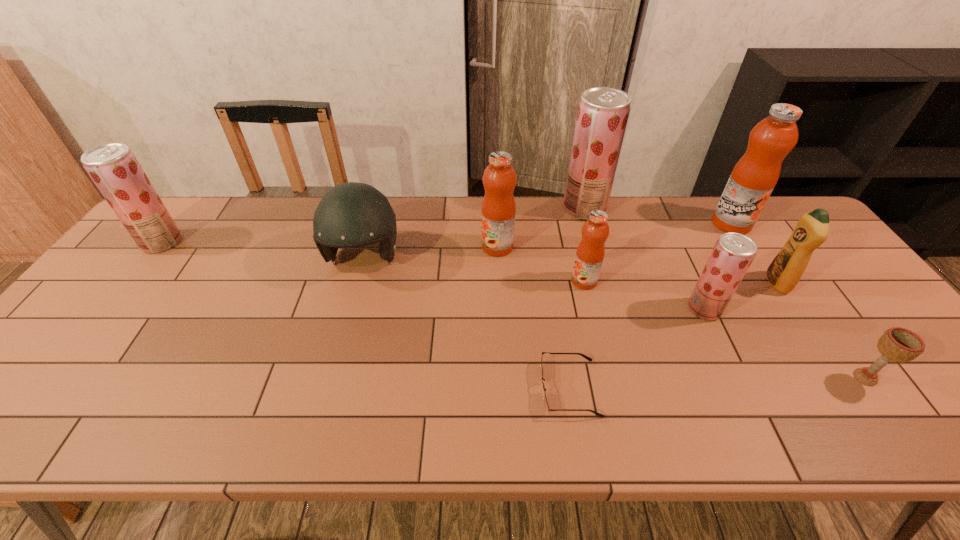
I want to click on free space that is in between the second object from left to right and the spectacles, so click(467, 323).

The image size is (960, 540). What are the coordinates of `vacant space that is in between the black spectacles and the rightmost orange fruit juice` in the screenshot? It's located at (650, 306).

Identify the location of unoccupied area between the smallest orange fruit juice and the leftmost object. (373, 261).

Image resolution: width=960 pixels, height=540 pixels. Identify the location of vacant area between the shortest object and the fifth farthest fruit juice. (577, 335).

You are a GUI agent. You are given a task and a screenshot of the screen. Output one action in this format:
    pyautogui.click(x=<x>, y=<y>)
    Task: Click on the empty space that is in between the black spectacles and the rightmost orange fruit juice
    This screenshot has height=540, width=960.
    Given the screenshot: What is the action you would take?
    pyautogui.click(x=650, y=306)

You are a GUI agent. You are given a task and a screenshot of the screen. Output one action in this format:
    pyautogui.click(x=<x>, y=<y>)
    Task: Click on the free space between the farthest orange fruit juice and the shortest object
    The width and height of the screenshot is (960, 540).
    Given the screenshot: What is the action you would take?
    pyautogui.click(x=650, y=306)

Select which object appears as the closest to the leftmost strawberry fruit juice. Please provide its 2D coordinates. Your answer should be formatted as a tuple, i.e. [(x, y)], where the tuple contains the x and y coordinates of a point satisfying the conditions above.

[(352, 214)]

The height and width of the screenshot is (540, 960). What are the coordinates of `object that stands as the third closest to the beige chalice` in the screenshot? It's located at (755, 175).

Where is `fruit juice that can be found as the third closest to the spectacles`? The width and height of the screenshot is (960, 540). fruit juice that can be found as the third closest to the spectacles is located at coordinates (498, 210).

Locate an element on the screen. the fourth closest fruit juice to the biggest strawberry fruit juice is located at coordinates (733, 253).